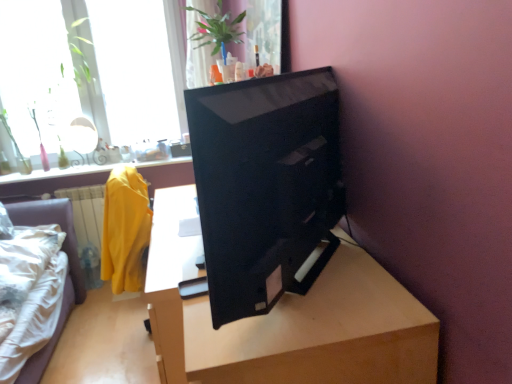
What is the approximate width of black glossy monitor at center?

black glossy monitor at center is 5.52 inches in width.

This screenshot has height=384, width=512. What do you see at coordinates (36, 73) in the screenshot?
I see `transparent glass window at upper left, which is the second window in right-to-left order` at bounding box center [36, 73].

I want to click on transparent glass window at upper left, which appears as the 1th window when viewed from the left, so click(36, 73).

Where is `white fabric bed at lower left`? The width and height of the screenshot is (512, 384). white fabric bed at lower left is located at coordinates (62, 229).

Is point (368, 309) in front of point (57, 101)?

Yes, it is in front of point (57, 101).

Which object is positioned more to the left, light brown wood table at center or transparent glass window at upper left, which is the second window in right-to-left order?

transparent glass window at upper left, which is the second window in right-to-left order, is more to the left.

From a real-world perspective, relative to transparent glass window at upper left, which appears as the 1th window when viewed from the left, is light brown wood table at center vertically above or below?

From a real-world perspective, light brown wood table at center is physically below transparent glass window at upper left, which appears as the 1th window when viewed from the left.

Is light brown wood table at center not inside transparent glass window at upper left, which is the second window in right-to-left order?

That's correct, light brown wood table at center is outside of transparent glass window at upper left, which is the second window in right-to-left order.

Find the location of `computer monitor in front of the transparent glass window at upper left, which is counted as the second window, starting from the left`. computer monitor in front of the transparent glass window at upper left, which is counted as the second window, starting from the left is located at coordinates (265, 185).

Who is taller, transparent glass window at upper left, which is counted as the second window, starting from the left, or black glossy monitor at center?

Standing taller between the two is transparent glass window at upper left, which is counted as the second window, starting from the left.

Is black glossy monitor at center surrounded by transparent glass window at upper left, which is counted as the second window, starting from the left?

That's incorrect, black glossy monitor at center is not inside transparent glass window at upper left, which is counted as the second window, starting from the left.

Does white fabric bed at lower left contain light brown wood table at center?

Definitely not — light brown wood table at center is not inside white fabric bed at lower left.

Image resolution: width=512 pixels, height=384 pixels. I want to click on table located above the white fabric bed at lower left (from a real-world perspective), so click(285, 319).

Considering the positions of objects white fabric bed at lower left and light brown wood table at center in the image provided, who is in front, white fabric bed at lower left or light brown wood table at center?

Positioned in front is light brown wood table at center.

Considering the relative sizes of white fabric bed at lower left and light brown wood table at center in the image provided, is white fabric bed at lower left taller than light brown wood table at center?

Yes, white fabric bed at lower left is taller than light brown wood table at center.

Considering the sizes of objects transparent glass window at upper left, positioned as the 1th window in right-to-left order, and white fabric bed at lower left in the image provided, who is wider, transparent glass window at upper left, positioned as the 1th window in right-to-left order, or white fabric bed at lower left?

white fabric bed at lower left is wider.

Is point (47, 61) positioned behind point (60, 218)?

Yes, it is behind point (60, 218).

Image resolution: width=512 pixels, height=384 pixels. I want to click on the 2nd window above the white fabric bed at lower left (from the image's perspective), so click(135, 70).

Which object is positioned more to the right, transparent glass window at upper left, which is counted as the second window, starting from the left, or transparent glass window at upper left, which is the second window in right-to-left order?

transparent glass window at upper left, which is counted as the second window, starting from the left.

Which is behind, transparent glass window at upper left, positioned as the 1th window in right-to-left order, or transparent glass window at upper left, which is the second window in right-to-left order?

transparent glass window at upper left, positioned as the 1th window in right-to-left order, is more distant.

From a real-world perspective, between transparent glass window at upper left, positioned as the 1th window in right-to-left order, and transparent glass window at upper left, which is the second window in right-to-left order, who is vertically lower?

transparent glass window at upper left, which is the second window in right-to-left order, is physically lower.

Who is bigger, transparent glass window at upper left, which is counted as the second window, starting from the left, or transparent glass window at upper left, which is the second window in right-to-left order?

transparent glass window at upper left, which is the second window in right-to-left order, is bigger.

From the image's perspective, is white fabric bed at lower left positioned above or below black glossy monitor at center?

Clearly, from the image's perspective, white fabric bed at lower left is below black glossy monitor at center.

Who is more distant, white fabric bed at lower left or black glossy monitor at center?

white fabric bed at lower left is behind.

Measure the distance between white fabric bed at lower left and black glossy monitor at center.

2.30 meters.

Considering the relative positions of white fabric bed at lower left and black glossy monitor at center in the image provided, is white fabric bed at lower left to the left of black glossy monitor at center from the viewer's perspective?

Correct, you'll find white fabric bed at lower left to the left of black glossy monitor at center.

Is transparent glass window at upper left, which appears as the 1th window when viewed from the left, further to camera compared to white fabric bed at lower left?

Yes, it is.

Considering the relative sizes of transparent glass window at upper left, which is the second window in right-to-left order, and white fabric bed at lower left in the image provided, is transparent glass window at upper left, which is the second window in right-to-left order, smaller than white fabric bed at lower left?

Indeed, transparent glass window at upper left, which is the second window in right-to-left order, has a smaller size compared to white fabric bed at lower left.

Can white fabric bed at lower left be found inside transparent glass window at upper left, which is the second window in right-to-left order?

That's incorrect, white fabric bed at lower left is not inside transparent glass window at upper left, which is the second window in right-to-left order.

Locate an element on the screen. The image size is (512, 384). furniture below the transparent glass window at upper left, which appears as the 1th window when viewed from the left (from a real-world perspective) is located at coordinates (62, 229).

Where is `table in front of the transparent glass window at upper left, which is the second window in right-to-left order`? table in front of the transparent glass window at upper left, which is the second window in right-to-left order is located at coordinates (285, 319).

You are a GUI agent. You are given a task and a screenshot of the screen. Output one action in this format:
    pyautogui.click(x=<x>, y=<y>)
    Task: Click on the computer monitor lying below the transparent glass window at upper left, positioned as the 1th window in right-to-left order (from the image's perspective)
    Image resolution: width=512 pixels, height=384 pixels.
    Given the screenshot: What is the action you would take?
    pyautogui.click(x=265, y=185)

From the image, which object appears to be farther from black glossy monitor at center, light brown wood table at center or transparent glass window at upper left, positioned as the 1th window in right-to-left order?

transparent glass window at upper left, positioned as the 1th window in right-to-left order, is positioned further to the anchor black glossy monitor at center.

Estimate the real-world distances between objects in this image. Which object is closer to transparent glass window at upper left, positioned as the 1th window in right-to-left order, transparent glass window at upper left, which appears as the 1th window when viewed from the left, or white fabric bed at lower left?

Among the two, transparent glass window at upper left, which appears as the 1th window when viewed from the left, is located nearer to transparent glass window at upper left, positioned as the 1th window in right-to-left order.

When comparing their distances from white fabric bed at lower left, does transparent glass window at upper left, which is counted as the second window, starting from the left, or black glossy monitor at center seem further?

Based on the image, black glossy monitor at center appears to be further to white fabric bed at lower left.

Which object lies further to the anchor point transparent glass window at upper left, which is the second window in right-to-left order, black glossy monitor at center or white fabric bed at lower left?

The object further to transparent glass window at upper left, which is the second window in right-to-left order, is black glossy monitor at center.

Based on their spatial positions, is light brown wood table at center or black glossy monitor at center closer to transparent glass window at upper left, which is counted as the second window, starting from the left?

light brown wood table at center.

Considering their positions, is black glossy monitor at center positioned closer to transparent glass window at upper left, which appears as the 1th window when viewed from the left, than light brown wood table at center?

Based on the image, light brown wood table at center appears to be nearer to transparent glass window at upper left, which appears as the 1th window when viewed from the left.

Considering their positions, is white fabric bed at lower left positioned closer to light brown wood table at center than transparent glass window at upper left, which is the second window in right-to-left order?

white fabric bed at lower left is closer to light brown wood table at center.

Based on their spatial positions, is white fabric bed at lower left or black glossy monitor at center closer to transparent glass window at upper left, which is counted as the second window, starting from the left?

white fabric bed at lower left is positioned closer to the anchor transparent glass window at upper left, which is counted as the second window, starting from the left.

What are the coordinates of `table located between black glossy monitor at center and transparent glass window at upper left, which appears as the 1th window when viewed from the left, in the depth direction` in the screenshot? It's located at (285, 319).

Find the location of a particular element. window located between light brown wood table at center and transparent glass window at upper left, which is counted as the second window, starting from the left, in the depth direction is located at coordinates (36, 73).

Find the location of a particular element. This screenshot has height=384, width=512. furniture between black glossy monitor at center and transparent glass window at upper left, positioned as the 1th window in right-to-left order, in the front-back direction is located at coordinates (62, 229).

Identify the location of furniture between light brown wood table at center and transparent glass window at upper left, positioned as the 1th window in right-to-left order, along the z-axis. The width and height of the screenshot is (512, 384). (62, 229).